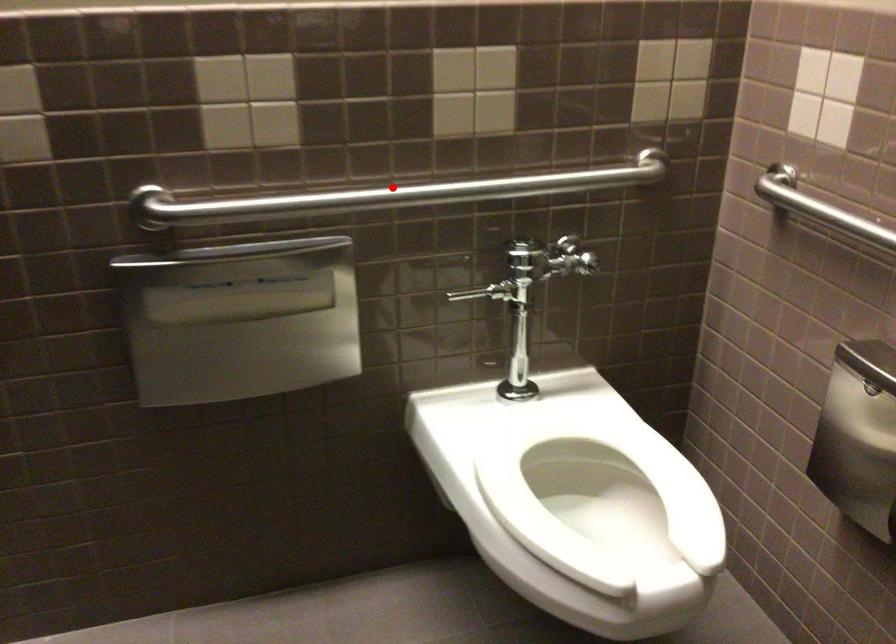
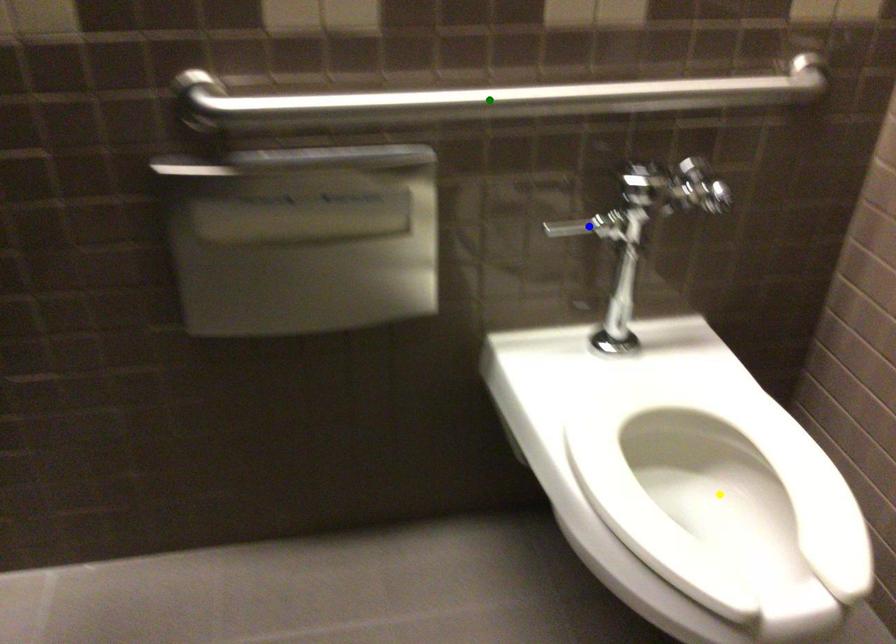
Question: I am providing you with two images of the same scene from different viewpoints. A red point is marked on the first image. You are given multiple points on the second image. Which mark in image 2 goes with the point in image 1?

Choices:
 (A) yellow point
 (B) green point
 (C) blue point

Answer: (B)